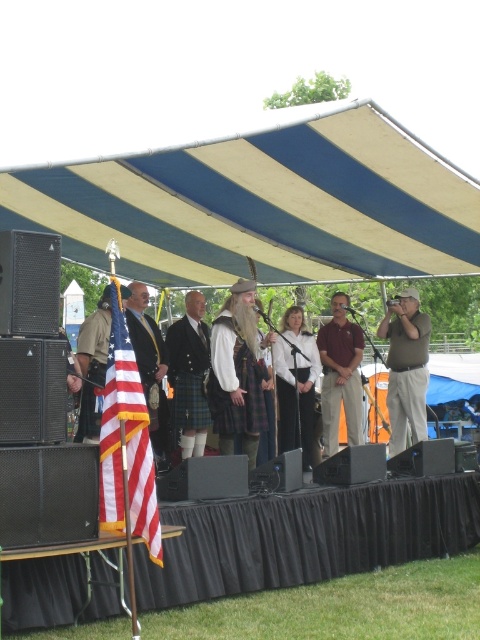
Can you confirm if blue striped canopy at upper center is smaller than matte green shirt at center?

Indeed, blue striped canopy at upper center has a smaller size compared to matte green shirt at center.

Between blue striped canopy at upper center and matte green shirt at center, which one is positioned higher?

blue striped canopy at upper center is higher up.

You are a GUI agent. You are given a task and a screenshot of the screen. Output one action in this format:
    pyautogui.click(x=<x>, y=<y>)
    Task: Click on the blue striped canopy at upper center
    
    Given the screenshot: What is the action you would take?
    pyautogui.click(x=263, y=204)

Is point (358, 352) more distant than point (156, 353)?

Yes, point (358, 352) is farther from viewer.

Is brown leather jacket at center closer to camera compared to matte black suit at center?

No, it is behind matte black suit at center.

Is point (335, 353) in front of point (130, 300)?

No, (335, 353) is behind (130, 300).

At what (x,y) coordinates should I click in order to perform the action: click on brown leather jacket at center. Please return your answer as a coordinate pair (x, y). The image size is (480, 640). Looking at the image, I should click on (340, 376).

In the scene shown: Does blue striped canopy at upper center appear on the right side of red-white striped fabric flag at left?

Indeed, blue striped canopy at upper center is positioned on the right side of red-white striped fabric flag at left.

Does blue striped canopy at upper center appear on the left side of red-white striped fabric flag at left?

Incorrect, blue striped canopy at upper center is not on the left side of red-white striped fabric flag at left.

Find the location of a particular element. This screenshot has width=480, height=640. blue striped canopy at upper center is located at coordinates pyautogui.click(x=263, y=204).

Where is `blue striped canopy at upper center`? blue striped canopy at upper center is located at coordinates (x=263, y=204).